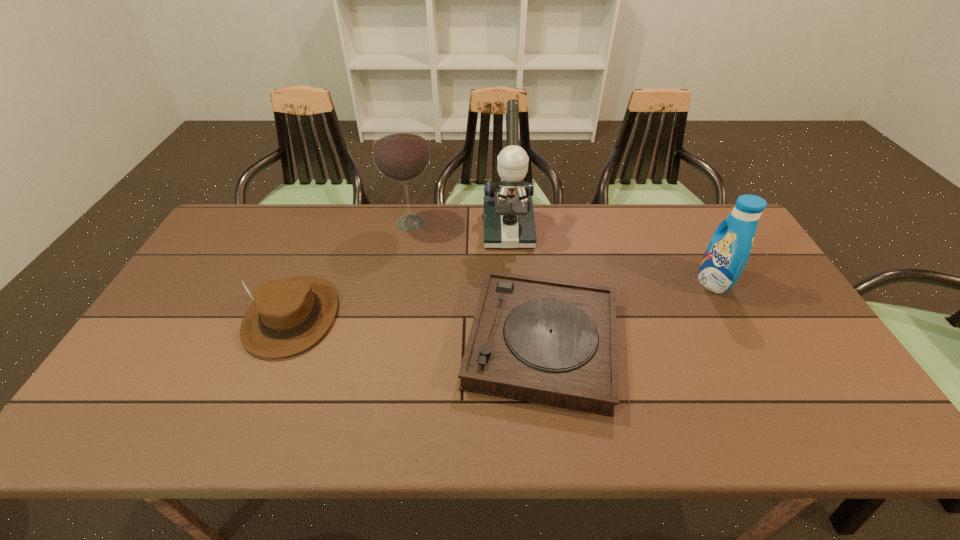
The height and width of the screenshot is (540, 960). In order to click on object that is the second closest to the shortest object in this screenshot , I will do `click(400, 150)`.

The width and height of the screenshot is (960, 540). What are the coordinates of `free space that satisfies the following two spatial constraints: 1. on the feather side of the phonograph record; 2. on the left side of the fedora` in the screenshot? It's located at (281, 343).

I want to click on free location that satisfies the following two spatial constraints: 1. at the eyepiece of the phonograph record; 2. on the left side of the microscope, so click(x=516, y=343).

This screenshot has height=540, width=960. I want to click on free location that satisfies the following two spatial constraints: 1. on the feather side of the phonograph record; 2. on the left side of the leftmost object, so click(281, 343).